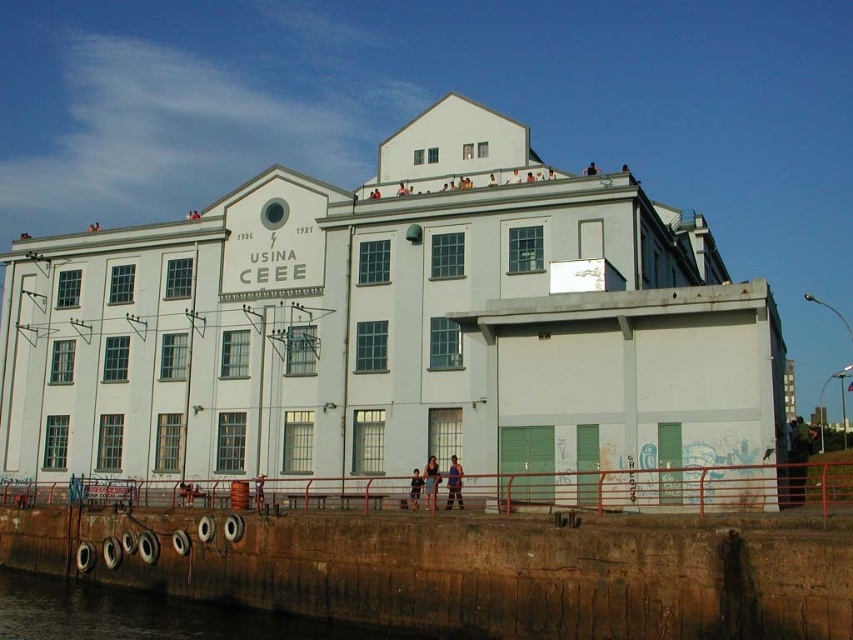
Question: Estimate the real-world distances between objects in this image. Which object is closer to the matte black shirt at center?

Choices:
 (A) dark blue jeans at lower center
 (B) brown concrete water at lower left

Answer: (A)

Question: Can you confirm if brown concrete water at lower left is thinner than matte black shirt at center?

Choices:
 (A) no
 (B) yes

Answer: (A)

Question: Which point appears farthest from the camera in this image?

Choices:
 (A) (434, 497)
 (B) (415, 490)
 (C) (76, 616)

Answer: (B)

Question: Is brown concrete water at lower left further to the viewer compared to smooth skin person at lower center?

Choices:
 (A) yes
 (B) no

Answer: (B)

Question: Does dark blue jeans at lower center have a greater width compared to smooth skin person at lower center?

Choices:
 (A) yes
 (B) no

Answer: (A)

Question: Which point is farther to the camera?

Choices:
 (A) brown concrete water at lower left
 (B) smooth skin person at lower center
 (C) matte black shirt at center

Answer: (B)